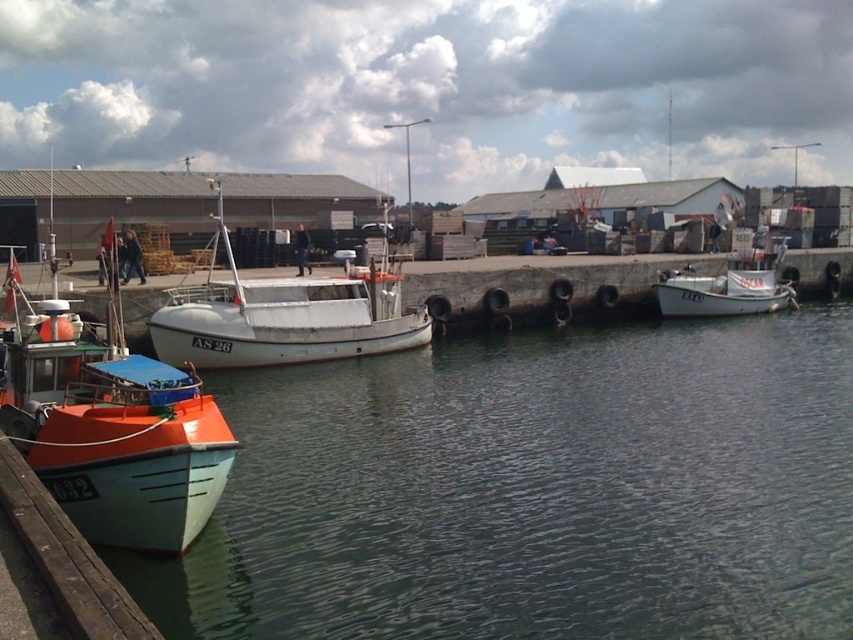
Is point (766, 426) positioned before point (3, 339)?

No, it is not.

Is green matte water at lower left positioned at the back of orange matte boat at lower left?

No, it is in front of orange matte boat at lower left.

Which is in front, point (668, 452) or point (57, 417)?

Point (57, 417) is in front.

Locate an element on the screen. This screenshot has height=640, width=853. green matte water at lower left is located at coordinates (532, 490).

Who is taller, white matte boat at center or white matte boat at right?

white matte boat at center is taller.

Can you confirm if white matte boat at center is positioned below white matte boat at right?

Incorrect, white matte boat at center is not positioned below white matte boat at right.

The width and height of the screenshot is (853, 640). Identify the location of white matte boat at center. (283, 317).

Is point (167, 536) positioned in front of point (668, 298)?

Yes, it is in front of point (668, 298).

Is orange matte boat at lower left smaller than white matte boat at right?

Actually, orange matte boat at lower left might be larger than white matte boat at right.

The width and height of the screenshot is (853, 640). In order to click on orange matte boat at lower left in this screenshot , I will do `click(112, 426)`.

This screenshot has height=640, width=853. In order to click on orange matte boat at lower left in this screenshot , I will do `click(112, 426)`.